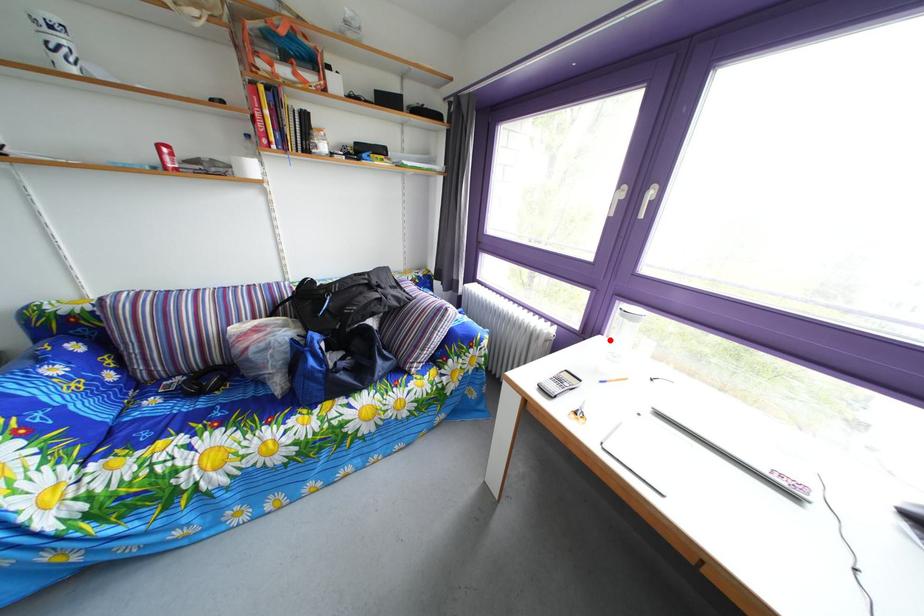
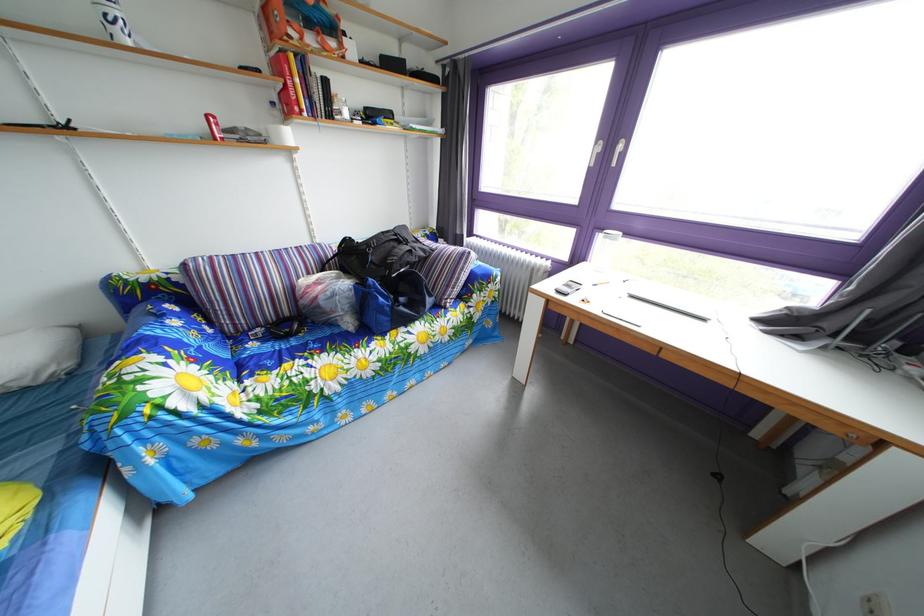
Find the pixel in the second image that matches the highlighted location in the first image.

(594, 268)